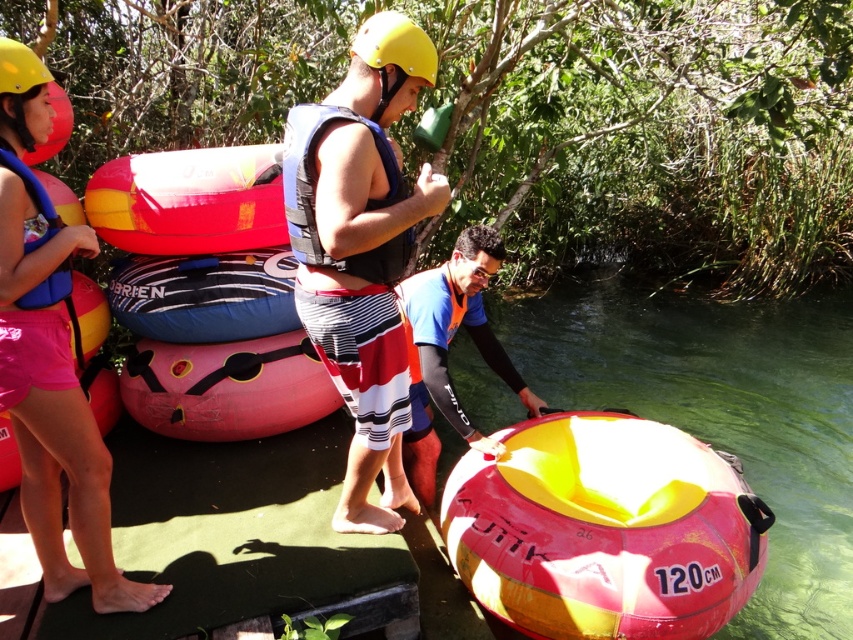
Does pink fabric shorts at left lie in front of yellow matte helmet at center?

Yes.

Does pink fabric shorts at left have a greater height compared to yellow matte helmet at center?

Correct, pink fabric shorts at left is much taller as yellow matte helmet at center.

Locate an element on the screen. pink fabric shorts at left is located at coordinates (49, 358).

Who is taller, pink rubber tube at lower right or pink rubber tube at center?

pink rubber tube at lower right is taller.

Is pink rubber tube at lower right above pink rubber tube at center?

No, pink rubber tube at lower right is not above pink rubber tube at center.

Between point (737, 556) and point (254, 422), which one is positioned in front?

Point (737, 556)

At what (x,y) coordinates should I click in order to perform the action: click on pink rubber tube at lower right. Please return your answer as a coordinate pair (x, y). The image size is (853, 640). Looking at the image, I should click on (604, 529).

Who is positioned more to the left, pink fabric shorts at left or blue matte life vest at center?

Positioned to the left is pink fabric shorts at left.

Consider the image. Who is positioned more to the right, pink fabric shorts at left or blue matte life vest at center?

From the viewer's perspective, blue matte life vest at center appears more on the right side.

Where is `pink fabric shorts at left`? pink fabric shorts at left is located at coordinates (49, 358).